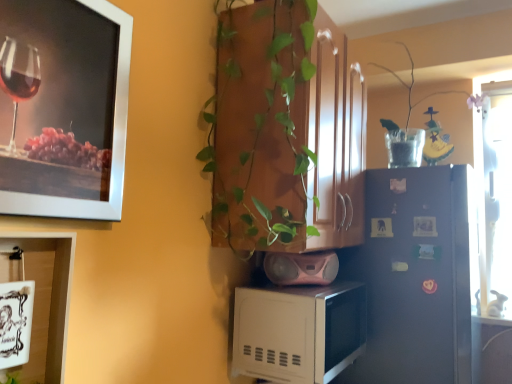
Question: Is metallic silver picture frame at upper left, arranged as the first picture frame when viewed from the top, outside of white glossy cabinet at lower left?

Choices:
 (A) yes
 (B) no

Answer: (A)

Question: Can you confirm if metallic silver picture frame at upper left, the 2th picture frame from the bottom, is wider than white glossy cabinet at lower left?

Choices:
 (A) no
 (B) yes

Answer: (A)

Question: Is white glossy cabinet at lower left inside metallic silver picture frame at upper left, the 2th picture frame from the bottom?

Choices:
 (A) yes
 (B) no

Answer: (B)

Question: Can you confirm if metallic silver picture frame at upper left, arranged as the first picture frame when viewed from the top, is positioned to the left of white glossy cabinet at lower left?

Choices:
 (A) yes
 (B) no

Answer: (B)

Question: Is metallic silver picture frame at upper left, arranged as the first picture frame when viewed from the top, bigger than white glossy cabinet at lower left?

Choices:
 (A) no
 (B) yes

Answer: (B)

Question: Visually, is metallic silver picture frame at upper left, arranged as the first picture frame when viewed from the top, positioned to the left or to the right of green glossy plant at center?

Choices:
 (A) left
 (B) right

Answer: (A)

Question: Do you think metallic silver picture frame at upper left, the 2th picture frame from the bottom, is within green glossy plant at center, or outside of it?

Choices:
 (A) outside
 (B) inside

Answer: (A)

Question: From a real-world perspective, is metallic silver picture frame at upper left, arranged as the first picture frame when viewed from the top, physically located above or below green glossy plant at center?

Choices:
 (A) below
 (B) above

Answer: (A)

Question: From the image's perspective, relative to green glossy plant at center, is metallic silver picture frame at upper left, the 2th picture frame from the bottom, above or below?

Choices:
 (A) above
 (B) below

Answer: (A)

Question: In terms of size, does satin blue refrigerator at center right appear bigger or smaller than clear glass vase at upper right?

Choices:
 (A) big
 (B) small

Answer: (A)

Question: Is satin blue refrigerator at center right inside the boundaries of clear glass vase at upper right, or outside?

Choices:
 (A) outside
 (B) inside

Answer: (A)

Question: Is point (443, 289) closer or farther from the camera than point (380, 132)?

Choices:
 (A) farther
 (B) closer

Answer: (B)

Question: From a real-world perspective, is satin blue refrigerator at center right above or below clear glass vase at upper right?

Choices:
 (A) above
 (B) below

Answer: (B)

Question: Does point coord(412,228) appear closer or farther from the camera than point coord(272,336)?

Choices:
 (A) closer
 (B) farther

Answer: (B)

Question: From the image's perspective, relative to white matte microwave at lower center, is satin blue refrigerator at center right above or below?

Choices:
 (A) above
 (B) below

Answer: (B)